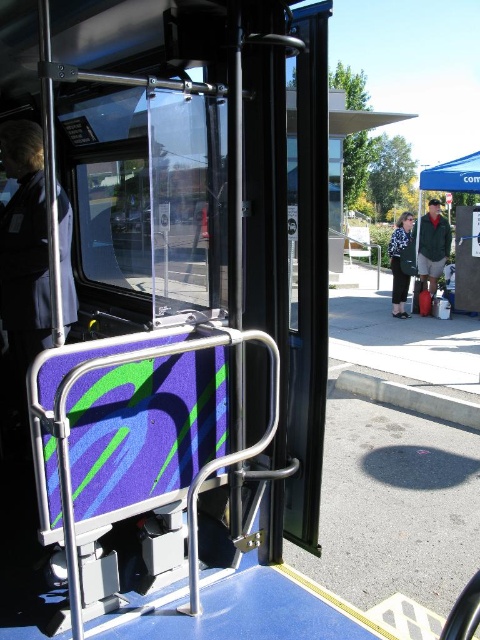
Who is more forward, [431,259] or [431,173]?

Positioned in front is point [431,259].

Can you confirm if green fabric jacket at center is positioned to the left of blue fabric canopy at upper right?

Correct, you'll find green fabric jacket at center to the left of blue fabric canopy at upper right.

This screenshot has width=480, height=640. In order to click on green fabric jacket at center in this screenshot , I will do `click(432, 246)`.

The height and width of the screenshot is (640, 480). In order to click on green fabric jacket at center in this screenshot , I will do `click(432, 246)`.

What do you see at coordinates (410, 400) in the screenshot? I see `gray concrete curb at lower right` at bounding box center [410, 400].

Can you confirm if gray concrete curb at lower right is taller than green fabric tent at right?

Yes.

Image resolution: width=480 pixels, height=640 pixels. In order to click on gray concrete curb at lower right in this screenshot , I will do `click(410, 400)`.

Is gray concrete curb at lower right in front of patterned fabric jacket at center?

That is True.

Does gray concrete curb at lower right appear over patterned fabric jacket at center?

No.

Between point (346, 378) and point (408, 234), which one is positioned behind?

Point (408, 234)

Find the location of `gray concrete curb at lower right`. gray concrete curb at lower right is located at coordinates (410, 400).